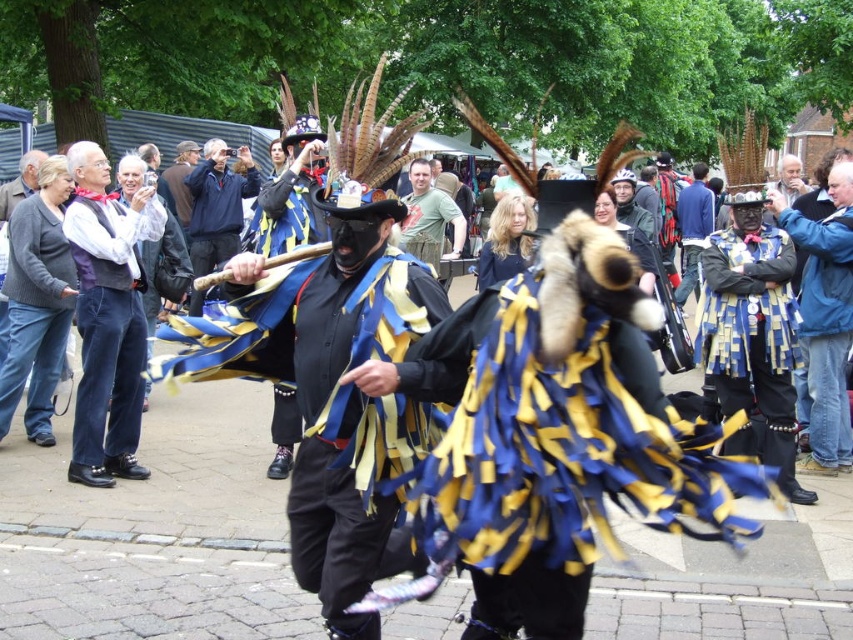
What object is located at the coordinates point (109, 324) in the scene?

The point (109, 324) corresponds to the matte black vest at left.